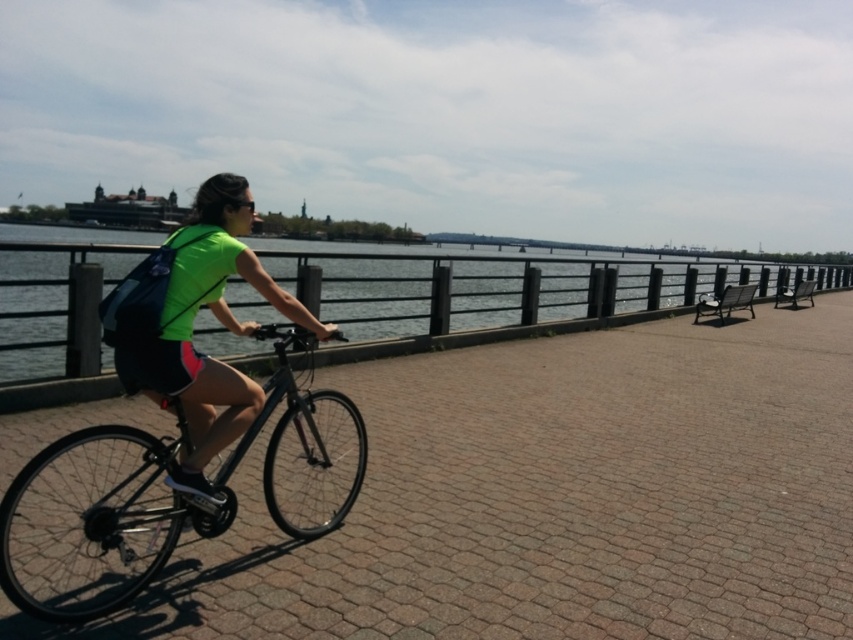
Does clear blue water at center have a greater height compared to shiny black bicycle at center?

Indeed, clear blue water at center has a greater height compared to shiny black bicycle at center.

Who is lower down, clear blue water at center or shiny black bicycle at center?

shiny black bicycle at center

Between point (355, 305) and point (39, 522), which one is positioned behind?

The point (355, 305) is more distant.

You are a GUI agent. You are given a task and a screenshot of the screen. Output one action in this format:
    pyautogui.click(x=<x>, y=<y>)
    Task: Click on the clear blue water at center
    
    Given the screenshot: What is the action you would take?
    pyautogui.click(x=502, y=285)

How much distance is there between shiny black bicycle at center and neon green fabric at center?

A distance of 27.26 inches exists between shiny black bicycle at center and neon green fabric at center.

Is point (90, 564) in front of point (212, 500)?

That is False.

Where is `shiny black bicycle at center`? Image resolution: width=853 pixels, height=640 pixels. shiny black bicycle at center is located at coordinates (143, 502).

Can you confirm if clear blue water at center is smaller than neon green fabric at center?

Actually, clear blue water at center might be larger than neon green fabric at center.

In the scene shown: Measure the distance between clear blue water at center and camera.

The distance of clear blue water at center from camera is 16.43 feet.

Which is behind, point (96, 237) or point (186, 296)?

Point (96, 237)

Locate an element on the screen. The height and width of the screenshot is (640, 853). clear blue water at center is located at coordinates (502, 285).